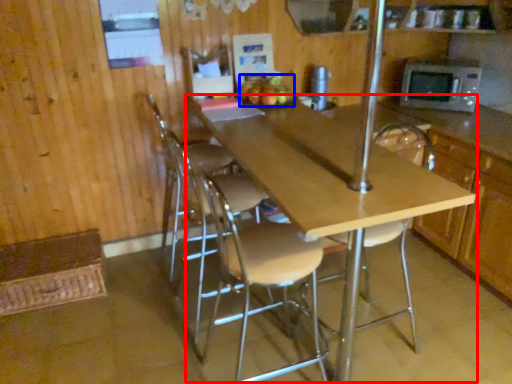
Question: Which point is further to the camera, table (highlighted by a red box) or apple (highlighted by a blue box)?

Choices:
 (A) table
 (B) apple

Answer: (B)